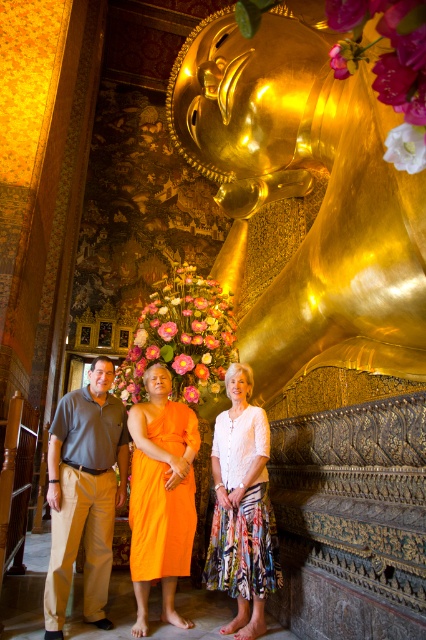
You are a visitor in the temple and want to take a photo of both the gold polished statue at center and the orange silk robe at center. Since you have a camera with a fixed focal length, you need to adjust your distance to ensure both objects are in focus. Considering their sizes, which object should you position closer to the camera to achieve this?

The gold polished statue at center is taller than the orange silk robe at center. To ensure both are in focus, you should position the gold polished statue at center closer to the camera since larger objects require being closer to the lens for proper focus when using a fixed focal length.

Based on the photo, you are standing in front of the reclining Buddha statue and want to take a photo of the matte orange robe at center without including the other people. Based on their positions, which direction should you move to ensure the robe is in the frame while excluding the others?

The matte orange robe at center is located at point (161, 496), so you should move to the right to exclude the other individuals while keeping the robe in view.

You are a photographer trying to capture the scene of the temple with the golden reclining Buddha statue. You notice two items at the center of your viewfinder, the khaki cotton pants at center and the orange silk robe at center. Which one appears smaller in your photo?

The khaki cotton pants at center appears smaller than the orange silk robe at center in the photo.